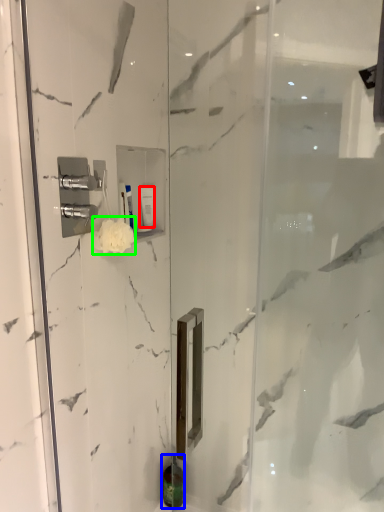
Question: Based on their relative distances, which object is farther from toiletry (highlighted by a red box)? Choose from toiletry (highlighted by a blue box) and flower (highlighted by a green box).

Choices:
 (A) toiletry
 (B) flower

Answer: (A)